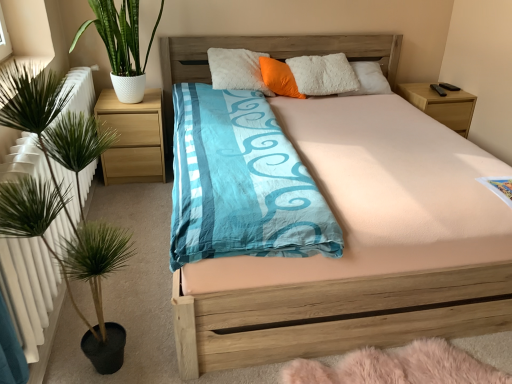
Question: Is the position of wooden bed at center less distant than that of orange fabric pillow at center?

Choices:
 (A) no
 (B) yes

Answer: (B)

Question: From the image's perspective, is wooden bed at center below orange fabric pillow at center?

Choices:
 (A) no
 (B) yes

Answer: (B)

Question: Considering the relative sizes of wooden bed at center and orange fabric pillow at center in the image provided, is wooden bed at center shorter than orange fabric pillow at center?

Choices:
 (A) no
 (B) yes

Answer: (A)

Question: Can you confirm if wooden bed at center is smaller than orange fabric pillow at center?

Choices:
 (A) yes
 (B) no

Answer: (B)

Question: From a real-world perspective, is wooden bed at center positioned under orange fabric pillow at center based on gravity?

Choices:
 (A) yes
 (B) no

Answer: (A)

Question: Is light wood/finish nightstand at left, which ranks as the second nightstand in right-to-left order, bigger or smaller than orange fabric pillow at center?

Choices:
 (A) small
 (B) big

Answer: (B)

Question: In terms of width, does light wood/finish nightstand at left, marked as the 1th nightstand in a left-to-right arrangement, look wider or thinner when compared to orange fabric pillow at center?

Choices:
 (A) wide
 (B) thin

Answer: (A)

Question: Considering the positions of light wood/finish nightstand at left, which ranks as the second nightstand in right-to-left order, and orange fabric pillow at center in the image, is light wood/finish nightstand at left, which ranks as the second nightstand in right-to-left order, taller or shorter than orange fabric pillow at center?

Choices:
 (A) tall
 (B) short

Answer: (A)

Question: In the image, is light wood/finish nightstand at left, which ranks as the second nightstand in right-to-left order, positioned in front of or behind orange fabric pillow at center?

Choices:
 (A) front
 (B) behind

Answer: (A)

Question: In the image, is wooden bed at center positioned in front of or behind light wood/texture nightstand at right, placed as the 1th nightstand when sorted from right to left?

Choices:
 (A) behind
 (B) front

Answer: (B)

Question: In the image, is wooden bed at center on the left side or the right side of light wood/texture nightstand at right, which is the 2th nightstand from left to right?

Choices:
 (A) right
 (B) left

Answer: (B)

Question: From the image's perspective, relative to light wood/texture nightstand at right, placed as the 1th nightstand when sorted from right to left, is wooden bed at center above or below?

Choices:
 (A) above
 (B) below

Answer: (B)

Question: Considering the positions of point (376, 284) and point (467, 115), is point (376, 284) closer or farther from the camera than point (467, 115)?

Choices:
 (A) closer
 (B) farther

Answer: (A)

Question: Based on their positions, is wooden bed at center located to the left or right of green leafy plant at left, marked as the second houseplant in a top-to-bottom arrangement?

Choices:
 (A) right
 (B) left

Answer: (A)

Question: Considering the positions of point (238, 289) and point (30, 87), is point (238, 289) closer or farther from the camera than point (30, 87)?

Choices:
 (A) farther
 (B) closer

Answer: (A)